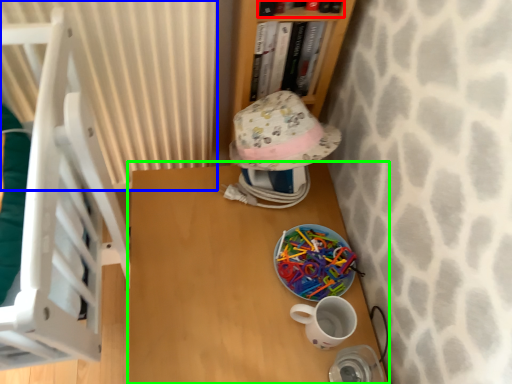
Question: Which object is positioned closest to book (highlighted by a red box)? Select from curtain (highlighted by a blue box) and table (highlighted by a green box).

Choices:
 (A) curtain
 (B) table

Answer: (A)